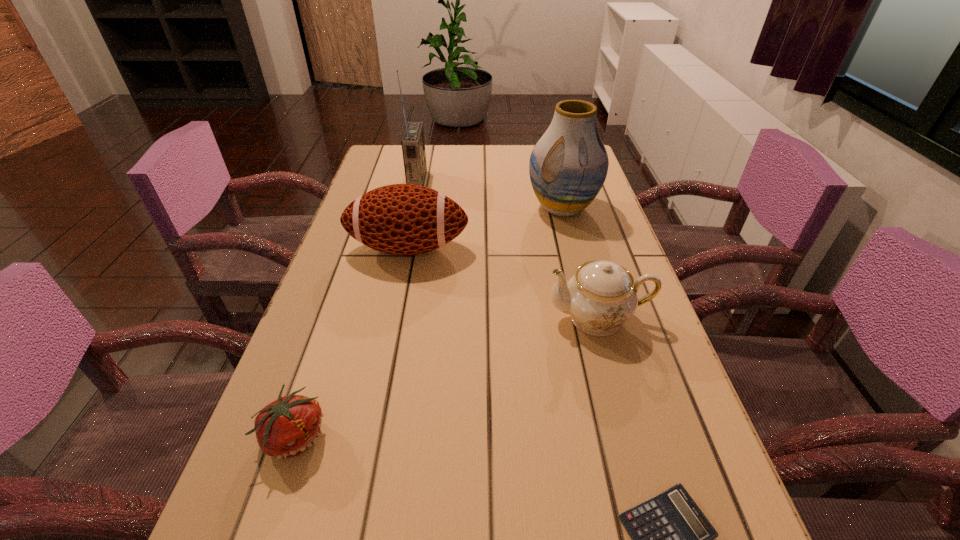
Identify the location of radio receiver. This screenshot has height=540, width=960. (413, 144).

The image size is (960, 540). I want to click on vase, so click(x=568, y=166).

The height and width of the screenshot is (540, 960). Identify the location of football. (400, 219).

You are a GUI agent. You are given a task and a screenshot of the screen. Output one action in this format:
    pyautogui.click(x=<x>, y=<y>)
    Task: Click on the chinaware
    
    Given the screenshot: What is the action you would take?
    pyautogui.click(x=602, y=296)

The image size is (960, 540). I want to click on the third nearest object, so click(602, 296).

Find the location of a particular element. This screenshot has height=540, width=960. the second nearest object is located at coordinates (287, 427).

This screenshot has width=960, height=540. I want to click on tomato, so click(x=287, y=427).

Find the location of a particular element. The image size is (960, 540). vacant space located 0.210m on the display of the radio receiver is located at coordinates (492, 181).

The image size is (960, 540). I want to click on vacant space situated on the left of the vase, so click(488, 208).

You are a GUI agent. You are given a task and a screenshot of the screen. Output one action in this format:
    pyautogui.click(x=<x>, y=<y>)
    Task: Click on the free space located 0.400m on the front of the football
    The width and height of the screenshot is (960, 540).
    Given the screenshot: What is the action you would take?
    [x=373, y=419]